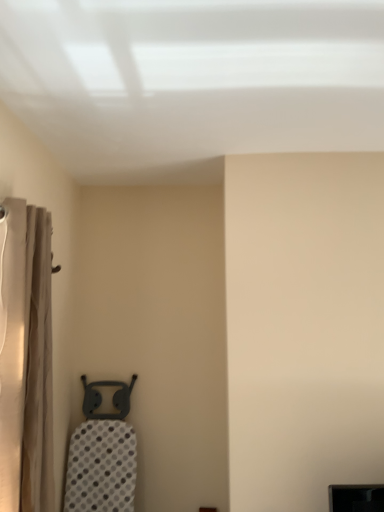
Describe the element at coordinates (25, 358) in the screenshot. I see `beige fabric curtain at left` at that location.

Identify the location of beige fabric curtain at left. (25, 358).

Find the location of a particular element. This screenshot has width=384, height=512. beige fabric curtain at left is located at coordinates (25, 358).